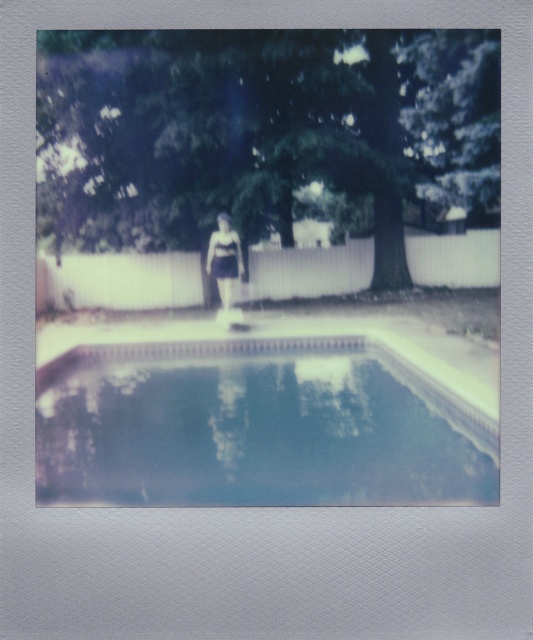
Between clear glass swimming pool at center and matte black swimsuit at center, which one is positioned lower?

clear glass swimming pool at center is lower down.

Does clear glass swimming pool at center have a smaller size compared to matte black swimsuit at center?

Incorrect, clear glass swimming pool at center is not smaller in size than matte black swimsuit at center.

Between point (327, 394) and point (219, 280), which one is positioned behind?

Point (219, 280)

Where is `clear glass swimming pool at center`? This screenshot has width=533, height=640. clear glass swimming pool at center is located at coordinates (256, 426).